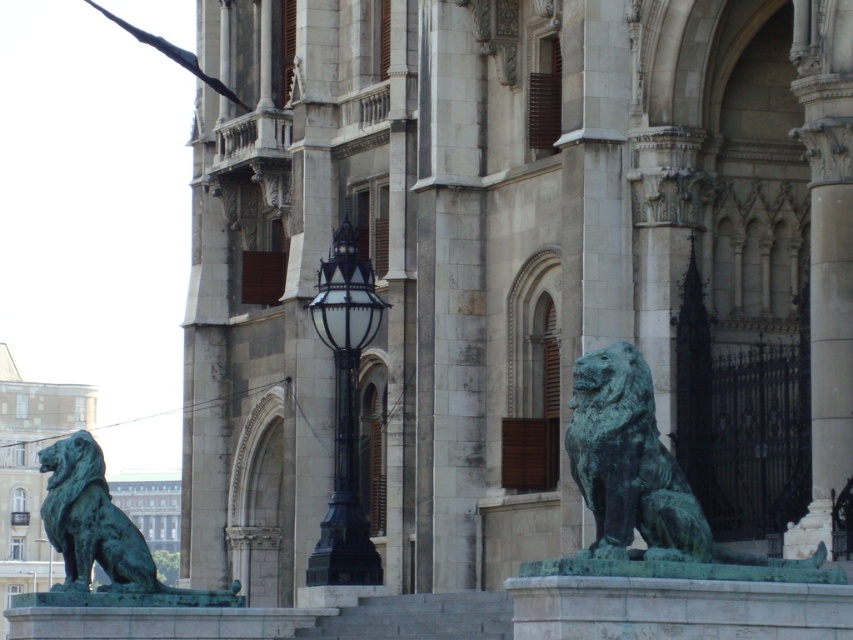
Question: Can you confirm if green patina stone lion at right is thinner than green patina lion at left?

Choices:
 (A) no
 (B) yes

Answer: (A)

Question: Is green patina stone lion at lower left wider than green patina stone lion at right?

Choices:
 (A) yes
 (B) no

Answer: (A)

Question: Which object appears closest to the camera in this image?

Choices:
 (A) green patina stone lion at lower left
 (B) black glass lamp post at center
 (C) green patina lion at left

Answer: (C)

Question: Which point is farther from the camera taking this photo?

Choices:
 (A) (111, 582)
 (B) (349, 301)
 (C) (370, 502)

Answer: (C)

Question: Based on their relative distances, which object is farther from the green patina lion at left?

Choices:
 (A) green patina stone lion at right
 (B) green patina stone lion at lower left

Answer: (A)

Question: Is green patina stone lion at right in front of green patina lion at left?

Choices:
 (A) yes
 (B) no

Answer: (A)